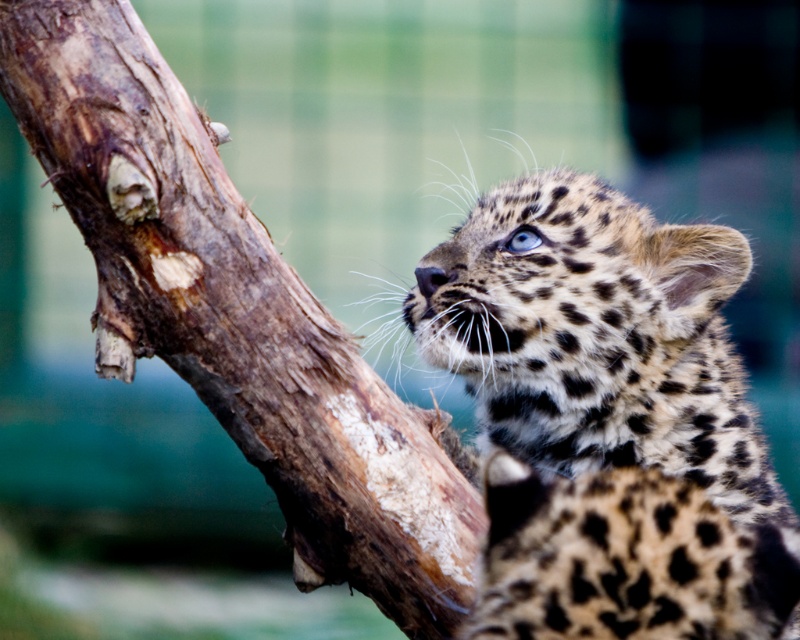
Question: Among these points, which one is farthest from the camera?

Choices:
 (A) (120, 77)
 (B) (694, 493)

Answer: (A)

Question: Can you confirm if spotted fur leopard at upper center is wider than brown rough tree trunk at upper left?

Choices:
 (A) yes
 (B) no

Answer: (B)

Question: Can you confirm if spotted fur leopard at upper center is positioned below brown rough tree trunk at upper left?

Choices:
 (A) yes
 (B) no

Answer: (A)

Question: Does spotted fur leopard at upper center appear under brown rough tree trunk at upper left?

Choices:
 (A) yes
 (B) no

Answer: (A)